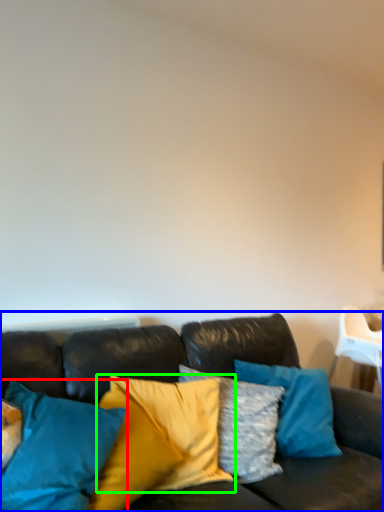
Question: Considering the real-world distances, which object is closest to pillow (highlighted by a red box)? studio couch (highlighted by a blue box) or pillow (highlighted by a green box).

Choices:
 (A) studio couch
 (B) pillow

Answer: (A)